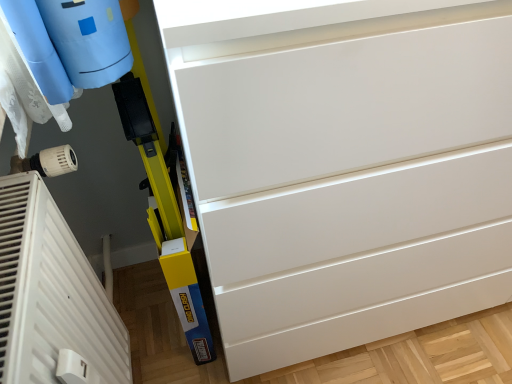
What do you see at coordinates (51, 293) in the screenshot?
I see `white matte radiator at left` at bounding box center [51, 293].

You are a GUI agent. You are given a task and a screenshot of the screen. Output one action in this format:
    pyautogui.click(x=<x>, y=<y>)
    Task: Click on the white matte radiator at left
    
    Given the screenshot: What is the action you would take?
    pyautogui.click(x=51, y=293)

You are a GUI agent. You are given a task and a screenshot of the screen. Output one action in this format:
    pyautogui.click(x=<x>, y=<y>)
    Task: Click on the white matte radiator at left
    
    Given the screenshot: What is the action you would take?
    pyautogui.click(x=51, y=293)